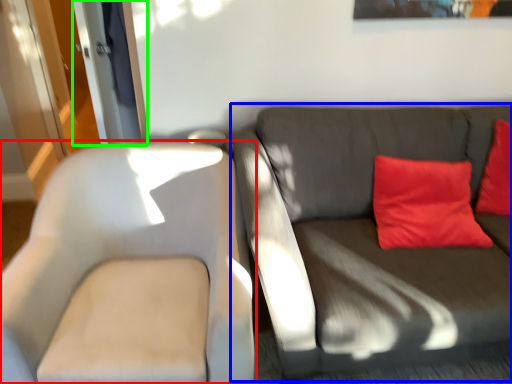
Question: Which object is the farthest from chair (highlighted by a red box)? Choose among these: studio couch (highlighted by a blue box) or glass door (highlighted by a green box).

Choices:
 (A) studio couch
 (B) glass door

Answer: (B)